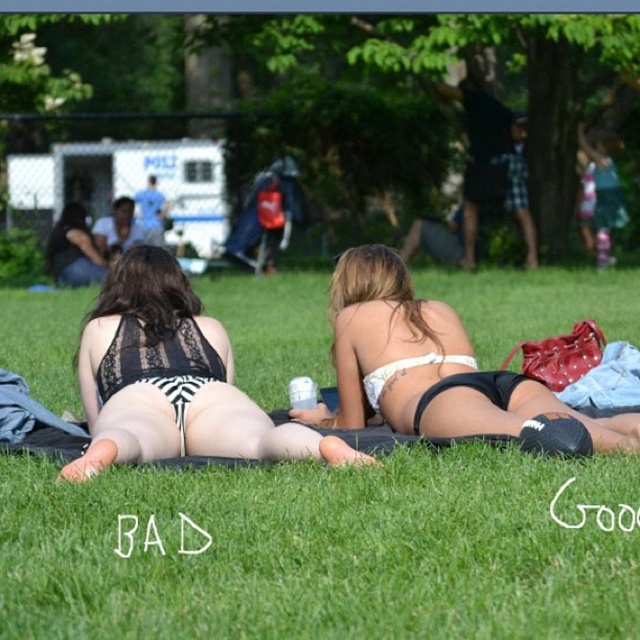
Question: Is black lace bikini at center bigger than matte black bikini at center?

Choices:
 (A) yes
 (B) no

Answer: (A)

Question: Which object is farther from the camera taking this photo?

Choices:
 (A) white matte bikini top at center
 (B) green grass at center
 (C) matte black bikini at center
 (D) black lace bikini at center

Answer: (C)

Question: Which object appears farthest from the camera in this image?

Choices:
 (A) white matte bikini top at center
 (B) black lace bikini at center
 (C) matte black bikini at center

Answer: (C)

Question: Is white matte bikini top at center bigger than matte black bikini at center?

Choices:
 (A) no
 (B) yes

Answer: (B)

Question: Among these objects, which one is nearest to the camera?

Choices:
 (A) white matte bikini top at center
 (B) black lace bikini at center
 (C) green grass at center

Answer: (C)

Question: Can you confirm if green grass at center is wider than matte black bikini at center?

Choices:
 (A) no
 (B) yes

Answer: (B)